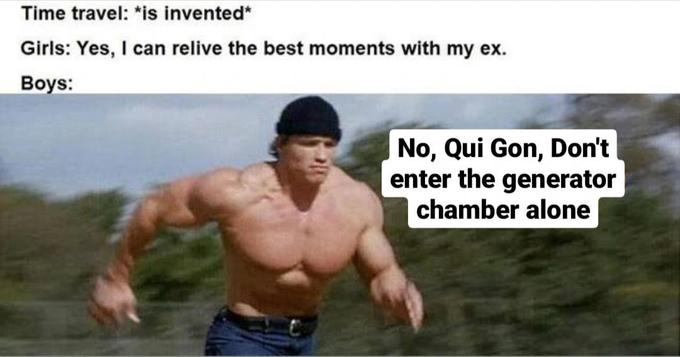
The width and height of the screenshot is (680, 357). In order to click on box in this screenshot , I will do `click(503, 169)`.